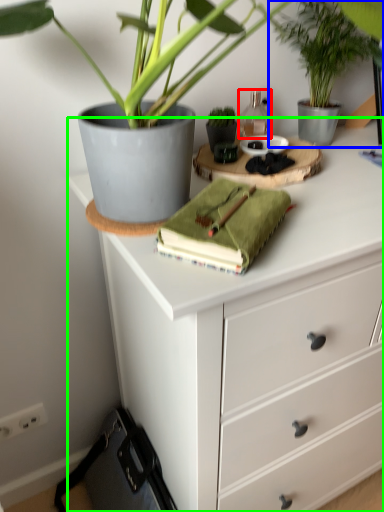
Question: Which is farther away from bottle (highlighted by a red box)? houseplant (highlighted by a blue box) or chest of drawers (highlighted by a green box)?

Choices:
 (A) houseplant
 (B) chest of drawers

Answer: (B)